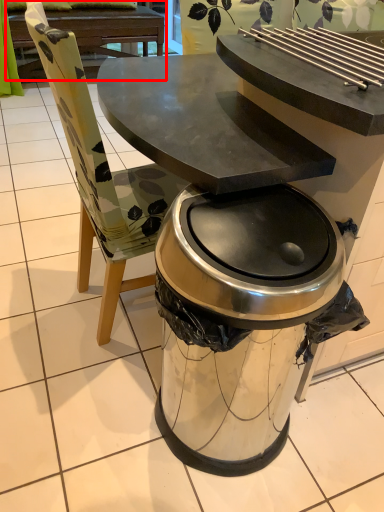
Question: From the image's perspective, what is the correct spatial positioning of picnic table (annotated by the red box) in reference to trash bin/can?

Choices:
 (A) below
 (B) above

Answer: (B)